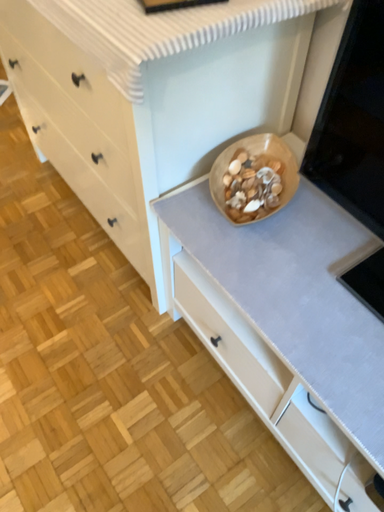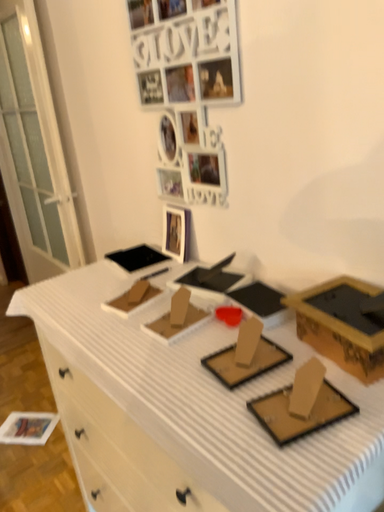
Question: Which way did the camera rotate in the video?

Choices:
 (A) rotated downward
 (B) rotated upward

Answer: (B)